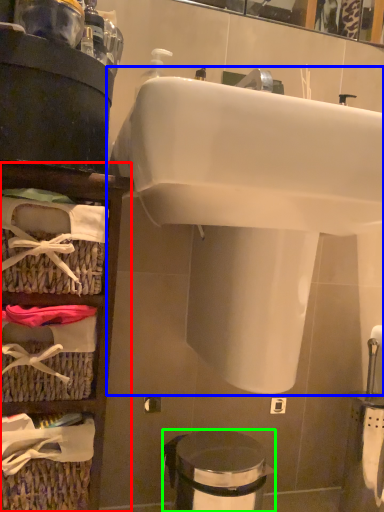
Question: Based on their relative distances, which object is nearer to shelf (highlighted by a red box)? Choose from sink (highlighted by a blue box) and trash bin/can (highlighted by a green box).

Choices:
 (A) sink
 (B) trash bin/can

Answer: (A)